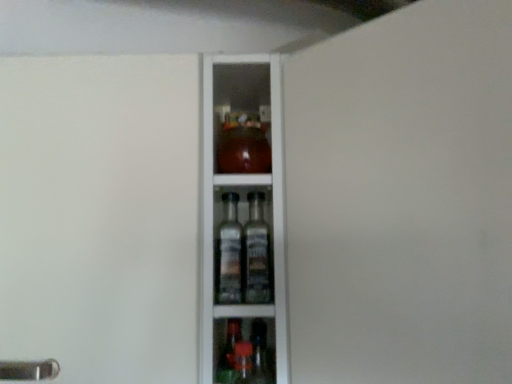
Question: Is transparent glass cabinet at center, the 1th screen door when ordered from right to left, in front of or behind transparent glass cabinet at center, placed as the 1th screen door when sorted from left to right, in the image?

Choices:
 (A) behind
 (B) front

Answer: (B)

Question: Do you think transparent glass cabinet at center, positioned as the second screen door in left-to-right order, is within transparent glass cabinet at center, placed as the second screen door when sorted from right to left, or outside of it?

Choices:
 (A) outside
 (B) inside

Answer: (A)

Question: Considering the positions of transparent glass cabinet at center, the 1th screen door when ordered from right to left, and transparent glass cabinet at center, placed as the 1th screen door when sorted from left to right, in the image, is transparent glass cabinet at center, the 1th screen door when ordered from right to left, wider or thinner than transparent glass cabinet at center, placed as the 1th screen door when sorted from left to right,?

Choices:
 (A) wide
 (B) thin

Answer: (B)

Question: Based on their positions, is transparent glass cabinet at center, placed as the 1th screen door when sorted from left to right, located to the left or right of transparent glass cabinet at center, the 1th screen door when ordered from right to left?

Choices:
 (A) right
 (B) left

Answer: (B)

Question: Considering the positions of transparent glass cabinet at center, placed as the 1th screen door when sorted from left to right, and transparent glass cabinet at center, positioned as the second screen door in left-to-right order, in the image, is transparent glass cabinet at center, placed as the 1th screen door when sorted from left to right, wider or thinner than transparent glass cabinet at center, positioned as the second screen door in left-to-right order,?

Choices:
 (A) thin
 (B) wide

Answer: (B)

Question: From their relative heights in the image, would you say transparent glass cabinet at center, placed as the 1th screen door when sorted from left to right, is taller or shorter than transparent glass cabinet at center, the 1th screen door when ordered from right to left?

Choices:
 (A) short
 (B) tall

Answer: (A)

Question: Does point (42, 200) appear closer or farther from the camera than point (458, 364)?

Choices:
 (A) farther
 (B) closer

Answer: (A)